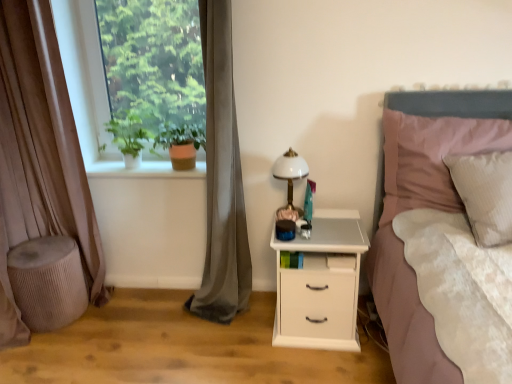
Question: From the image's perspective, is white glossy bedside lamp at center-right above or below textured beige stool at lower left?

Choices:
 (A) above
 (B) below

Answer: (A)

Question: Looking at the image, does white glossy bedside lamp at center-right seem bigger or smaller compared to textured beige stool at lower left?

Choices:
 (A) small
 (B) big

Answer: (A)

Question: Estimate the real-world distances between objects in this image. Which object is closer to the brown velvet curtain at left, the 2th curtain when ordered from right to left?

Choices:
 (A) green matte plant at upper left, positioned as the 1th plant in left-to-right order
 (B) gray velvet curtain at left, the first curtain in the right-to-left sequence
 (C) textured beige stool at lower left
 (D) smooth white surface at center left
 (E) white matte nightstand at lower right

Answer: (C)

Question: Which of these objects is positioned closest to the brown velvet curtain at left, which ranks as the 1th curtain in left-to-right order?

Choices:
 (A) white matte nightstand at lower right
 (B) pink fabric pillow at right
 (C) gray velvet curtain at left, the first curtain in the right-to-left sequence
 (D) green leafy plant at left
 (E) white glossy bedside lamp at center-right

Answer: (C)